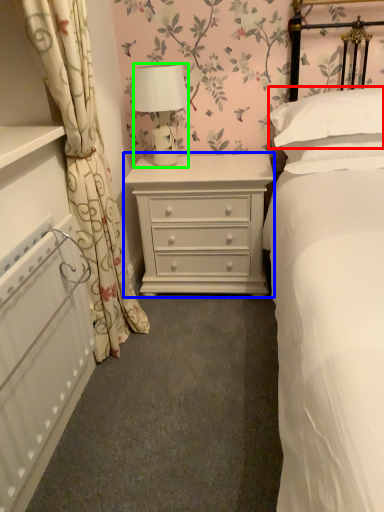
Question: Which is nearer to the pillow (highlighted by a red box)? chest of drawers (highlighted by a blue box) or lamp (highlighted by a green box).

Choices:
 (A) chest of drawers
 (B) lamp

Answer: (A)